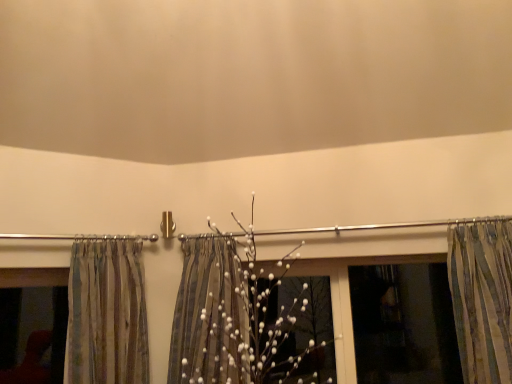
At what (x,y) coordinates should I click in order to perform the action: click on striped fabric shower curtain at center. Please return your answer as a coordinate pair (x, y). Looking at the image, I should click on (207, 315).

What do you see at coordinates (207, 315) in the screenshot? I see `striped fabric shower curtain at center` at bounding box center [207, 315].

What do you see at coordinates (106, 314) in the screenshot?
I see `striped fabric curtain at left, the 2th curtain from the right` at bounding box center [106, 314].

Find the location of a particular element. matte glass window at left is located at coordinates [x=33, y=277].

Locate an element on the screen. transparent plastic window screen at right is located at coordinates (404, 325).

Locate an element on the screen. striped fabric curtain at right, the 2th curtain in the left-to-right sequence is located at coordinates (482, 299).

How far apart are transparent plastic window screen at right and striped fabric shower curtain at center?

The distance of transparent plastic window screen at right from striped fabric shower curtain at center is 37.93 inches.

The width and height of the screenshot is (512, 384). I want to click on window screen that is under the striped fabric shower curtain at center (from a real-world perspective), so click(x=404, y=325).

From a real-world perspective, is transparent plastic window screen at right physically below striped fabric shower curtain at center?

Yes, from a real-world perspective, transparent plastic window screen at right is under striped fabric shower curtain at center.

Which is closer to the camera, (382,378) or (184,287)?

Point (382,378) appears to be closer to the viewer than point (184,287).

Is striped fabric curtain at left, marked as the 1th curtain in a left-to-right arrangement, directly adjacent to transparent plastic window screen at right?

striped fabric curtain at left, marked as the 1th curtain in a left-to-right arrangement, and transparent plastic window screen at right are not in contact.

In the scene shown: From a real-world perspective, is striped fabric curtain at left, the 2th curtain from the right, on transparent plastic window screen at right?

Yes, from a real-world perspective, striped fabric curtain at left, the 2th curtain from the right, is over transparent plastic window screen at right

Is striped fabric curtain at left, the 2th curtain from the right, in front of or behind transparent plastic window screen at right in the image?

Clearly, striped fabric curtain at left, the 2th curtain from the right, is in front of transparent plastic window screen at right.

What's the angular difference between striped fabric curtain at left, marked as the 1th curtain in a left-to-right arrangement, and transparent plastic window screen at right's facing directions?

striped fabric curtain at left, marked as the 1th curtain in a left-to-right arrangement, and transparent plastic window screen at right are facing 49.3 degrees away from each other.

Which of these two, striped fabric shower curtain at center or matte glass window at left, is smaller?

matte glass window at left is smaller.

Find the location of `window that appears behind the striped fabric shower curtain at center`. window that appears behind the striped fabric shower curtain at center is located at coordinates (33, 277).

Which object is closer to the camera taking this photo, striped fabric shower curtain at center or matte glass window at left?

striped fabric shower curtain at center is more forward.

Consider the image. Considering the relative positions of striped fabric curtain at right, which is the 1th curtain from right to left, and matte glass window at left in the image provided, is striped fabric curtain at right, which is the 1th curtain from right to left, to the right of matte glass window at left from the viewer's perspective?

Correct, you'll find striped fabric curtain at right, which is the 1th curtain from right to left, to the right of matte glass window at left.

Considering the sizes of objects striped fabric curtain at right, the 2th curtain in the left-to-right sequence, and matte glass window at left in the image provided, who is wider, striped fabric curtain at right, the 2th curtain in the left-to-right sequence, or matte glass window at left?

With larger width is striped fabric curtain at right, the 2th curtain in the left-to-right sequence.

Between striped fabric curtain at right, the 2th curtain in the left-to-right sequence, and matte glass window at left, which one is positioned in front?

Positioned in front is striped fabric curtain at right, the 2th curtain in the left-to-right sequence.

Locate an element on the screen. This screenshot has width=512, height=384. curtain that is the 2nd one when counting upward from the matte glass window at left (from the image's perspective) is located at coordinates (482, 299).

Is matte glass window at left positioned with its back to striped fabric shower curtain at center?

No, striped fabric shower curtain at center is not at the back of matte glass window at left.

Would you say matte glass window at left is a long distance from striped fabric shower curtain at center?

No.

Does point (27, 268) come behind point (177, 300)?

No, it is in front of (177, 300).

Between matte glass window at left and striped fabric curtain at left, marked as the 1th curtain in a left-to-right arrangement, which one has smaller width?

Thinner between the two is matte glass window at left.

From the image's perspective, who appears lower, matte glass window at left or striped fabric curtain at left, the 2th curtain from the right?

matte glass window at left, from the image's perspective.

From the picture: Is matte glass window at left to the left or to the right of striped fabric curtain at left, marked as the 1th curtain in a left-to-right arrangement, in the image?

From the image, it's evident that matte glass window at left is to the left of striped fabric curtain at left, marked as the 1th curtain in a left-to-right arrangement.

Considering the positions of points (34, 268) and (111, 331), is point (34, 268) closer to camera compared to point (111, 331)?

No.

How many degrees apart are the facing directions of striped fabric shower curtain at center and transparent plastic window screen at right?

The angular difference between striped fabric shower curtain at center and transparent plastic window screen at right is 11.3 degrees.

The width and height of the screenshot is (512, 384). Find the location of `window screen below the striped fabric shower curtain at center (from the image's perspective)`. window screen below the striped fabric shower curtain at center (from the image's perspective) is located at coordinates (404, 325).

Does striped fabric shower curtain at center have a greater height compared to transparent plastic window screen at right?

Yes.

Is striped fabric shower curtain at center facing towards transparent plastic window screen at right?

No, striped fabric shower curtain at center is not oriented towards transparent plastic window screen at right.

The image size is (512, 384). I want to click on window screen behind the striped fabric shower curtain at center, so click(404, 325).

Identify the location of window screen below the striped fabric curtain at left, marked as the 1th curtain in a left-to-right arrangement (from the image's perspective). (404, 325).

Considering their positions, is matte glass window at left positioned closer to striped fabric curtain at right, which is the 1th curtain from right to left, than striped fabric curtain at left, marked as the 1th curtain in a left-to-right arrangement?

striped fabric curtain at left, marked as the 1th curtain in a left-to-right arrangement, is closer to striped fabric curtain at right, which is the 1th curtain from right to left.

From the image, which object appears to be nearer to striped fabric curtain at right, which is the 1th curtain from right to left, matte glass window at left or transparent plastic window screen at right?

Based on the image, transparent plastic window screen at right appears to be nearer to striped fabric curtain at right, which is the 1th curtain from right to left.

From the image, which object appears to be farther from matte glass window at left, transparent plastic window screen at right or striped fabric shower curtain at center?

transparent plastic window screen at right.

When comparing their distances from matte glass window at left, does striped fabric curtain at right, the 2th curtain in the left-to-right sequence, or striped fabric shower curtain at center seem further?

The object further to matte glass window at left is striped fabric curtain at right, the 2th curtain in the left-to-right sequence.

Considering their positions, is striped fabric shower curtain at center positioned further to transparent plastic window screen at right than matte glass window at left?

Based on the image, matte glass window at left appears to be further to transparent plastic window screen at right.

When comparing their distances from striped fabric curtain at right, the 2th curtain in the left-to-right sequence, does striped fabric curtain at left, marked as the 1th curtain in a left-to-right arrangement, or striped fabric shower curtain at center seem closer?

Among the two, striped fabric shower curtain at center is located nearer to striped fabric curtain at right, the 2th curtain in the left-to-right sequence.

When comparing their distances from striped fabric curtain at right, the 2th curtain in the left-to-right sequence, does striped fabric curtain at left, marked as the 1th curtain in a left-to-right arrangement, or transparent plastic window screen at right seem closer?

transparent plastic window screen at right is positioned closer to the anchor striped fabric curtain at right, the 2th curtain in the left-to-right sequence.

From the image, which object appears to be nearer to striped fabric curtain at right, the 2th curtain in the left-to-right sequence, striped fabric curtain at left, the 2th curtain from the right, or matte glass window at left?

striped fabric curtain at left, the 2th curtain from the right.

Identify the location of shower curtain between striped fabric curtain at left, marked as the 1th curtain in a left-to-right arrangement, and striped fabric curtain at right, which is the 1th curtain from right to left, from left to right. This screenshot has height=384, width=512. (207, 315).

This screenshot has width=512, height=384. I want to click on curtain located between matte glass window at left and striped fabric shower curtain at center in the left-right direction, so click(106, 314).

Where is `curtain located between matte glass window at left and striped fabric curtain at right, the 2th curtain in the left-to-right sequence, in the left-right direction`? The width and height of the screenshot is (512, 384). curtain located between matte glass window at left and striped fabric curtain at right, the 2th curtain in the left-to-right sequence, in the left-right direction is located at coordinates (106, 314).

At what (x,y) coordinates should I click in order to perform the action: click on shower curtain between striped fabric curtain at left, marked as the 1th curtain in a left-to-right arrangement, and transparent plastic window screen at right from left to right. Please return your answer as a coordinate pair (x, y). This screenshot has width=512, height=384. Looking at the image, I should click on (207, 315).